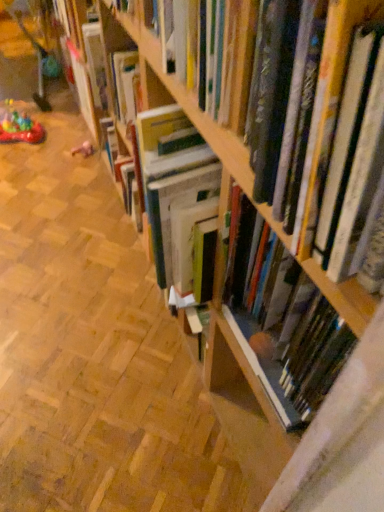
Question: Is wooden bookshelf at center surrounded by hardcover book at center, arranged as the 1th book when viewed from the back?

Choices:
 (A) yes
 (B) no

Answer: (B)

Question: Does hardcover book at center, arranged as the 1th book when viewed from the back, have a greater width compared to wooden bookshelf at center?

Choices:
 (A) yes
 (B) no

Answer: (B)

Question: Is hardcover book at center, the 2th book viewed from the front, located outside wooden bookshelf at center?

Choices:
 (A) no
 (B) yes

Answer: (B)

Question: Is hardcover book at center, arranged as the 1th book when viewed from the back, looking in the opposite direction of wooden bookshelf at center?

Choices:
 (A) no
 (B) yes

Answer: (A)

Question: Can you confirm if hardcover book at center, the 2th book viewed from the front, is smaller than wooden bookshelf at center?

Choices:
 (A) yes
 (B) no

Answer: (A)

Question: Are hardcover book at center, arranged as the 1th book when viewed from the back, and wooden bookshelf at center located far from each other?

Choices:
 (A) yes
 (B) no

Answer: (B)

Question: Is hardcover book at center, marked as the 1th book in a front-to-back arrangement, taller than pink fabric toy at lower left, acting as the 1th toy starting from the right?

Choices:
 (A) no
 (B) yes

Answer: (B)

Question: Does hardcover book at center, marked as the 1th book in a front-to-back arrangement, have a larger size compared to pink fabric toy at lower left, acting as the 1th toy starting from the right?

Choices:
 (A) no
 (B) yes

Answer: (B)

Question: Can you confirm if hardcover book at center, which appears as the second book when viewed from the back, is wider than pink fabric toy at lower left, acting as the 1th toy starting from the right?

Choices:
 (A) yes
 (B) no

Answer: (A)

Question: Is hardcover book at center, marked as the 1th book in a front-to-back arrangement, to the right of pink fabric toy at lower left, acting as the 1th toy starting from the right, from the viewer's perspective?

Choices:
 (A) no
 (B) yes

Answer: (B)

Question: From a real-world perspective, is hardcover book at center, which appears as the second book when viewed from the back, on pink fabric toy at lower left, which ranks as the 2th toy in left-to-right order?

Choices:
 (A) no
 (B) yes

Answer: (B)

Question: Is hardcover book at center, which appears as the second book when viewed from the back, looking in the opposite direction of pink fabric toy at lower left, acting as the 1th toy starting from the right?

Choices:
 (A) yes
 (B) no

Answer: (B)

Question: Is hardcover book at center, which appears as the second book when viewed from the back, positioned with its back to wooden bookshelf at center?

Choices:
 (A) no
 (B) yes

Answer: (A)